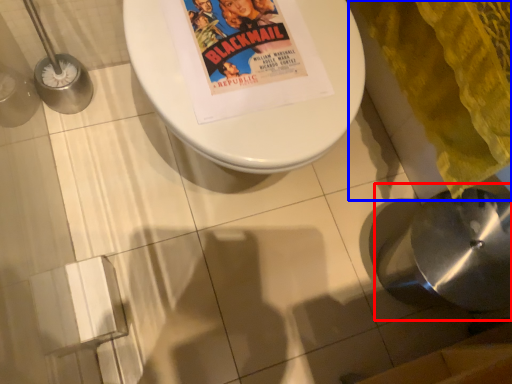
Question: Which object is further to the camera taking this photo, sink (highlighted by a red box) or blanket (highlighted by a blue box)?

Choices:
 (A) sink
 (B) blanket

Answer: (A)